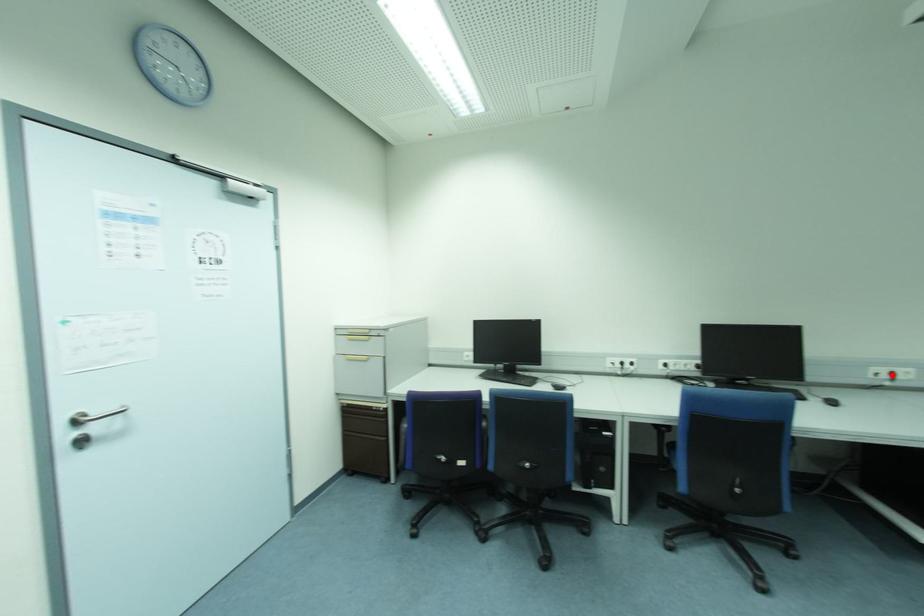
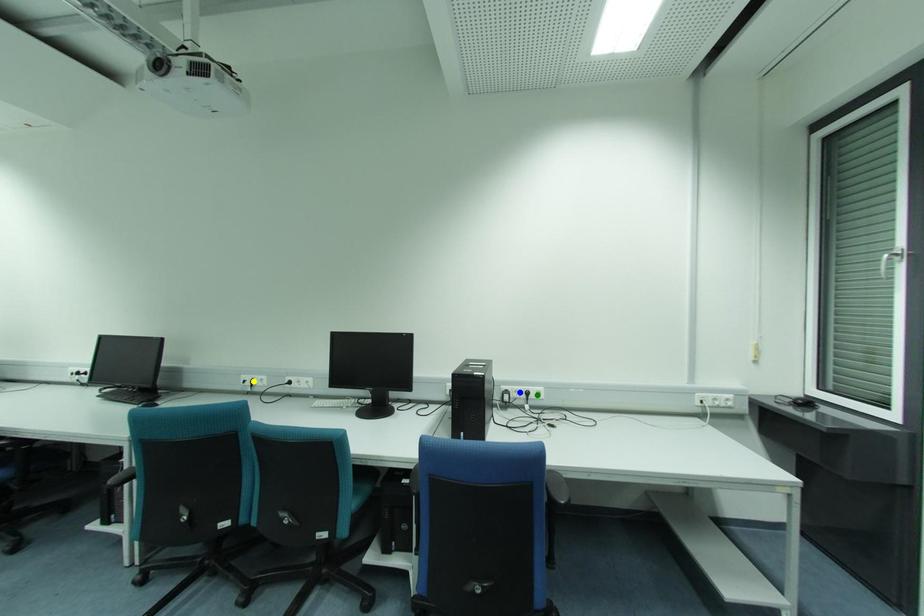
Question: I am providing you with two images of the same scene from different viewpoints. A red point is marked on the first image. You are given multiple points on the second image. Which point in image 2 is actually the same real-world point as the red point in image 1?

Choices:
 (A) blue point
 (B) yellow point
 (C) green point

Answer: (B)